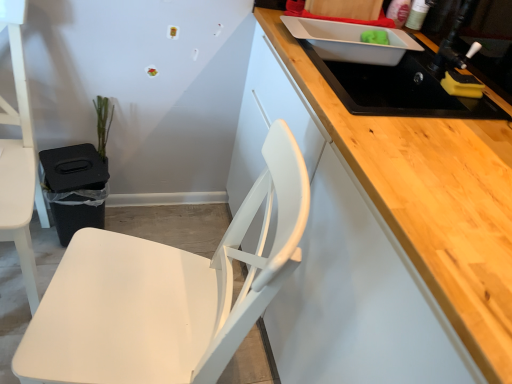
Question: From a real-world perspective, is white matte chair at lower left, the 2th chair in the left-to-right sequence, on top of white matte chair at left, positioned as the second chair in right-to-left order?

Choices:
 (A) no
 (B) yes

Answer: (B)

Question: From a real-world perspective, does white matte chair at lower left, which appears as the first chair when viewed from the right, sit lower than white matte chair at left, marked as the 1th chair in a left-to-right arrangement?

Choices:
 (A) no
 (B) yes

Answer: (A)

Question: Is white matte chair at lower left, which appears as the first chair when viewed from the right, outside white matte chair at left, marked as the 1th chair in a left-to-right arrangement?

Choices:
 (A) no
 (B) yes

Answer: (B)

Question: Is white matte chair at lower left, the 2th chair in the left-to-right sequence, facing towards white matte chair at left, marked as the 1th chair in a left-to-right arrangement?

Choices:
 (A) no
 (B) yes

Answer: (A)

Question: Does white matte chair at lower left, which appears as the first chair when viewed from the right, have a lesser width compared to white matte chair at left, positioned as the second chair in right-to-left order?

Choices:
 (A) no
 (B) yes

Answer: (A)

Question: From the image's perspective, is black matte sink at upper right located above or below white matte chair at left, positioned as the second chair in right-to-left order?

Choices:
 (A) below
 (B) above

Answer: (B)

Question: From a real-world perspective, is black matte sink at upper right physically located above or below white matte chair at left, marked as the 1th chair in a left-to-right arrangement?

Choices:
 (A) below
 (B) above

Answer: (B)

Question: Would you say black matte sink at upper right is to the left or to the right of white matte chair at left, positioned as the second chair in right-to-left order, in the picture?

Choices:
 (A) left
 (B) right

Answer: (B)

Question: Considering their positions, is black matte sink at upper right located in front of or behind white matte chair at left, positioned as the second chair in right-to-left order?

Choices:
 (A) behind
 (B) front

Answer: (A)

Question: From the image's perspective, is green matte plant at left above or below white matte chair at left, marked as the 1th chair in a left-to-right arrangement?

Choices:
 (A) below
 (B) above

Answer: (B)

Question: Is green matte plant at left wider or thinner than white matte chair at left, marked as the 1th chair in a left-to-right arrangement?

Choices:
 (A) wide
 (B) thin

Answer: (B)

Question: In terms of size, does green matte plant at left appear bigger or smaller than white matte chair at left, positioned as the second chair in right-to-left order?

Choices:
 (A) small
 (B) big

Answer: (A)

Question: From their relative heights in the image, would you say green matte plant at left is taller or shorter than white matte chair at left, marked as the 1th chair in a left-to-right arrangement?

Choices:
 (A) tall
 (B) short

Answer: (B)

Question: Is green matte plant at left wider or thinner than black matte sink at upper right?

Choices:
 (A) thin
 (B) wide

Answer: (A)

Question: Is point (103, 130) closer or farther from the camera than point (422, 110)?

Choices:
 (A) farther
 (B) closer

Answer: (A)